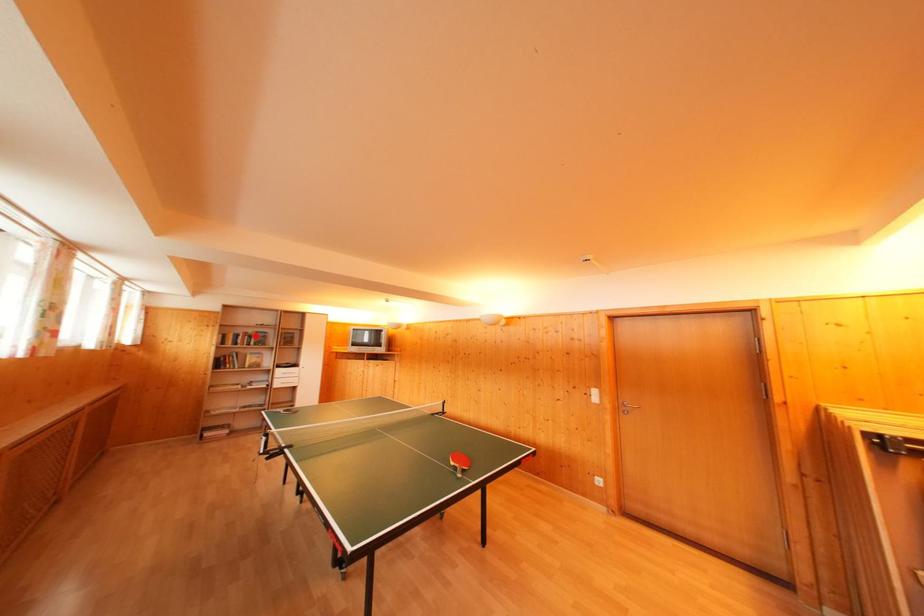
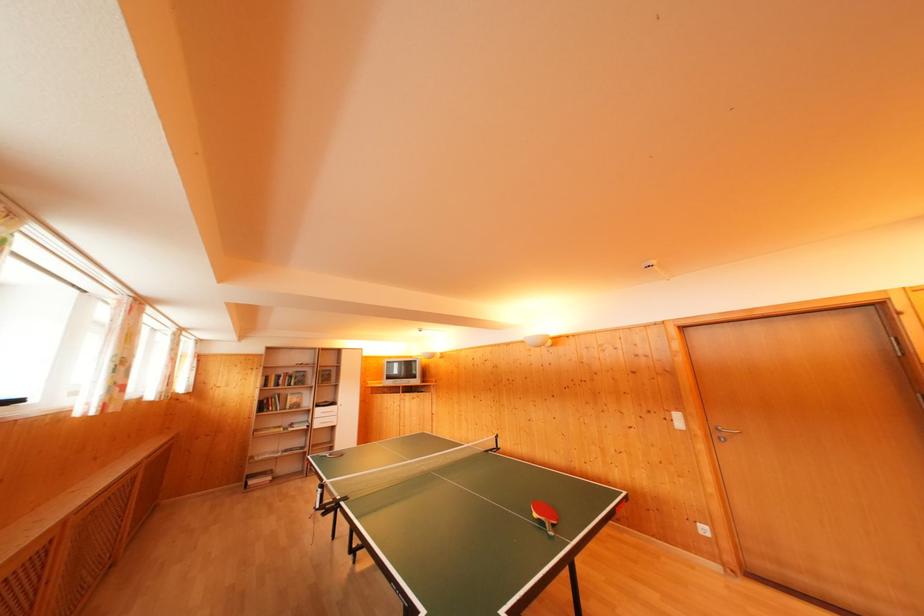
Question: A red point is marked in image1. In image2, is the corresponding 3D point closer to the camera or farther? Reply with the corresponding letter.

Choices:
 (A) The corresponding 3D point is closer.
 (B) The corresponding 3D point is farther.

Answer: (B)